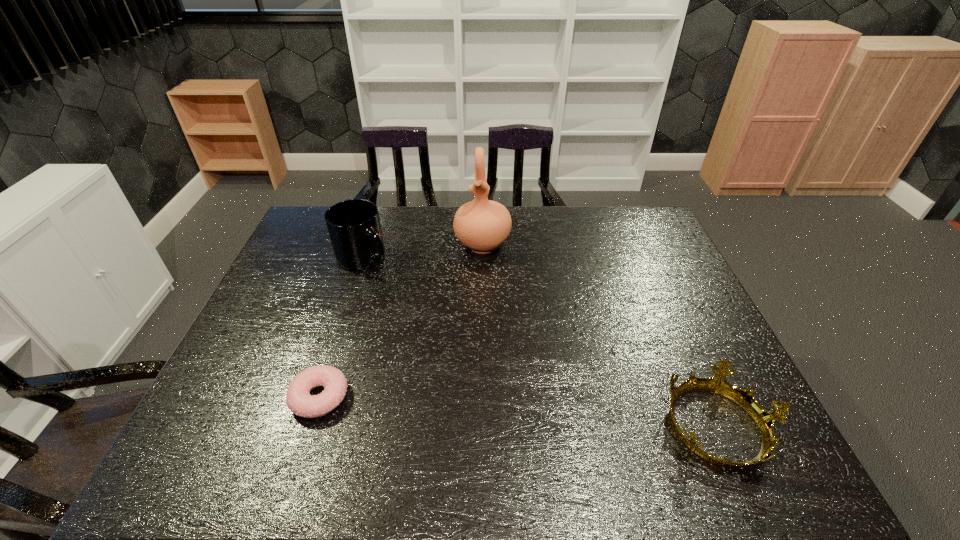
At what (x,y) coordinates should I click in order to perform the action: click on vacant area between the second shortest object and the tallest object. Please return your answer as a coordinate pair (x, y). This screenshot has height=540, width=960. Looking at the image, I should click on (600, 335).

At what (x,y) coordinates should I click in order to perform the action: click on free space between the rightmost object and the second tallest object. Please return your answer as a coordinate pair (x, y). The image size is (960, 540). Looking at the image, I should click on (541, 342).

Locate an element on the screen. The image size is (960, 540). free spot between the doughnut and the crown is located at coordinates (519, 411).

Image resolution: width=960 pixels, height=540 pixels. What are the coordinates of `vacant region between the third object from left to right and the rightmost object` in the screenshot? It's located at (600, 335).

This screenshot has width=960, height=540. Find the location of `vacant space that is in between the pottery and the third shortest object`. vacant space that is in between the pottery and the third shortest object is located at coordinates (423, 251).

Locate an element on the screen. The height and width of the screenshot is (540, 960). the third closest object relative to the pottery is located at coordinates (765, 420).

The width and height of the screenshot is (960, 540). I want to click on object that ranks as the second closest to the doughnut, so click(x=482, y=225).

At what (x,y) coordinates should I click in order to perform the action: click on vacant region that satisfies the following two spatial constraints: 1. on the back side of the pottery; 2. on the left side of the third shortest object. Please return your answer as a coordinate pair (x, y). The image size is (960, 540). Looking at the image, I should click on (369, 244).

In order to click on free space that satisfies the following two spatial constraints: 1. on the back side of the mug; 2. on the left side of the tallest object in this screenshot , I will do click(x=369, y=244).